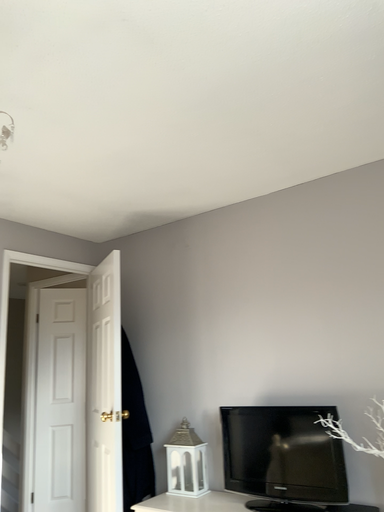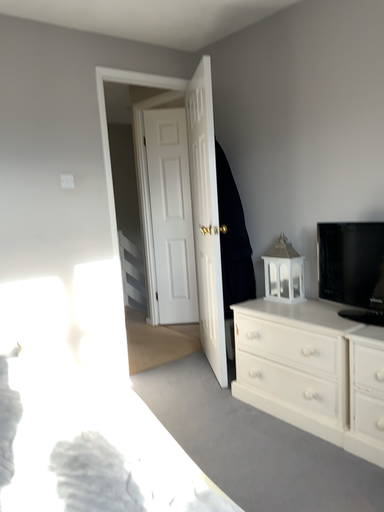
Question: How did the camera likely rotate when shooting the video?

Choices:
 (A) rotated upward
 (B) rotated downward

Answer: (B)